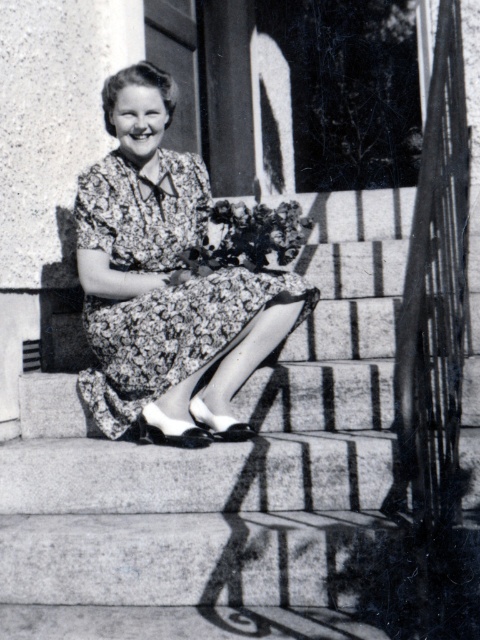
Based on the scene description, where are the smooth concrete stairs at center located in the image?

The smooth concrete stairs at center are located at point (237, 477).

From the picture: You are a photographer adjusting your camera settings to focus on two specific points in the image. The first point is at coordinates point (x=100, y=476) and the second is at point (x=231, y=204). Which point should you focus on first if you want to ensure the closest object is in sharp focus?

Point (x=100, y=476) is closer to the camera than point (x=231, y=204), so you should focus on point (x=100, y=476) first to ensure the closest object is in sharp focus.

You are standing in front of the stairs and want to place a small potted plant between the smooth concrete stairs at center and the floral dress at center. Which object should the plant be closer to based on their positions?

The smooth concrete stairs at center is closer to the viewer than the floral dress at center, so the plant should be placed closer to the floral dress at center to maintain the spatial relationship.